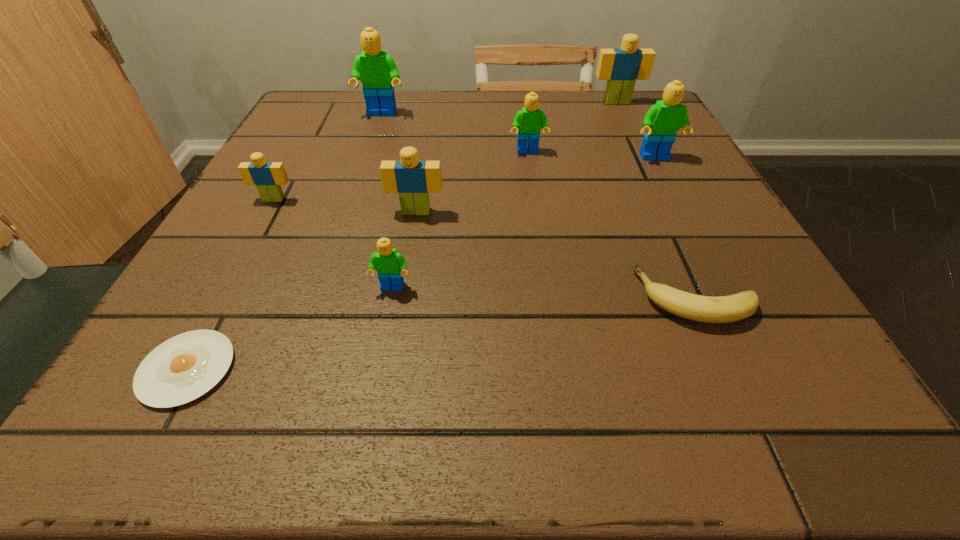
Find the location of `free spot between the nearest green Lego and the second biggest beige Lego`. free spot between the nearest green Lego and the second biggest beige Lego is located at coordinates (404, 250).

In order to click on vacant space that is in between the yellow banana and the second farthest object in this screenshot , I will do `click(540, 206)`.

Identify the location of vacant area between the third biggest green Lego and the second beige Lego from right to left. The width and height of the screenshot is (960, 540). (472, 182).

Locate an element on the screen. vacant point located between the fourth nearest object and the egg yolk is located at coordinates (301, 291).

This screenshot has width=960, height=540. I want to click on free space between the eighth tallest object and the sixth farthest object, so click(556, 255).

The image size is (960, 540). I want to click on unoccupied position between the third green Lego from left to right and the yellow banana, so click(x=612, y=225).

Where is `free point between the leftmost Lego and the shortest object`? The width and height of the screenshot is (960, 540). free point between the leftmost Lego and the shortest object is located at coordinates (230, 284).

Locate an element on the screen. object that stands as the fourth closest to the leftmost beige Lego is located at coordinates (377, 71).

I want to click on object that is the eighth closest to the second green Lego from right to left, so click(183, 368).

Choose which Lego is the fourth nearest neighbor to the fifth farthest Lego. Please provide its 2D coordinates. Your answer should be formatted as a tuple, i.e. [(x, y)], where the tuple contains the x and y coordinates of a point satisfying the conditions above.

[(530, 120)]